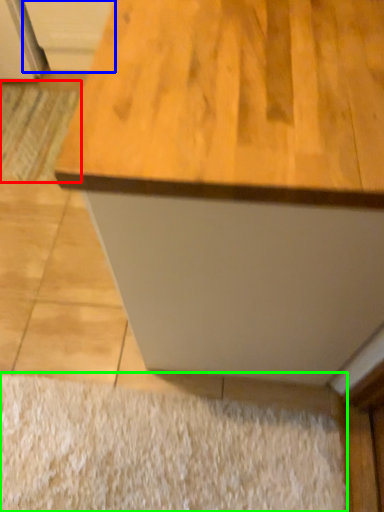
Question: Estimate the real-world distances between objects in this image. Which object is closer to doormat (highlighted by a red box), cabinetry (highlighted by a blue box) or doormat (highlighted by a green box)?

Choices:
 (A) cabinetry
 (B) doormat

Answer: (A)